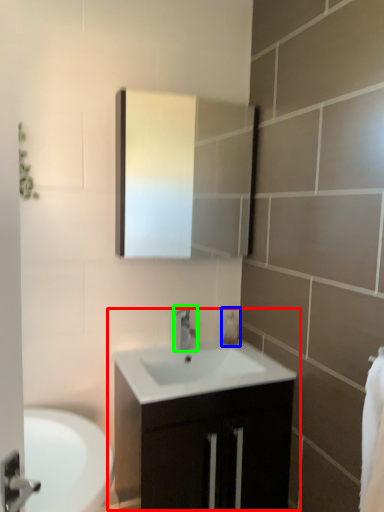
Question: Based on their relative distances, which object is nearer to bathroom cabinet (highlighted by a red box)? Choose from soap dispenser (highlighted by a blue box) and tap (highlighted by a green box).

Choices:
 (A) soap dispenser
 (B) tap

Answer: (B)